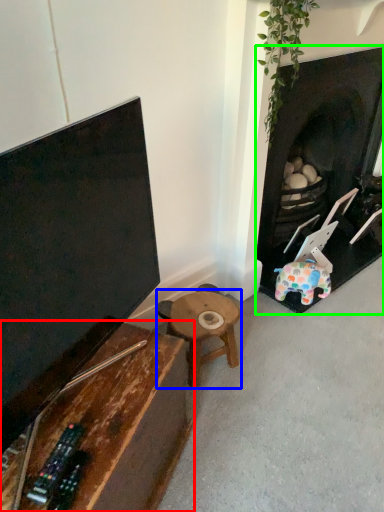
Question: Which object is positioned closest to table (highlighted by a red box)? Select from table (highlighted by a blue box) and fireplace (highlighted by a green box).

Choices:
 (A) table
 (B) fireplace

Answer: (A)